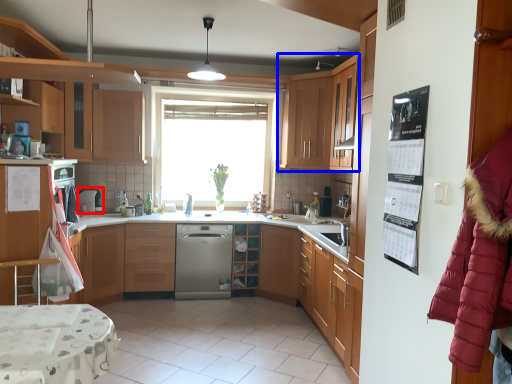
Question: Which point is closer to the camera, appliance (highlighted by a red box) or cabinetry (highlighted by a blue box)?

Choices:
 (A) appliance
 (B) cabinetry

Answer: (B)